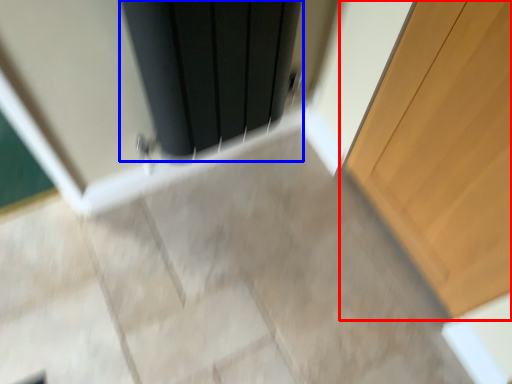
Question: Which point is further to the camera, door (highlighted by a red box) or screen door (highlighted by a blue box)?

Choices:
 (A) door
 (B) screen door

Answer: (B)